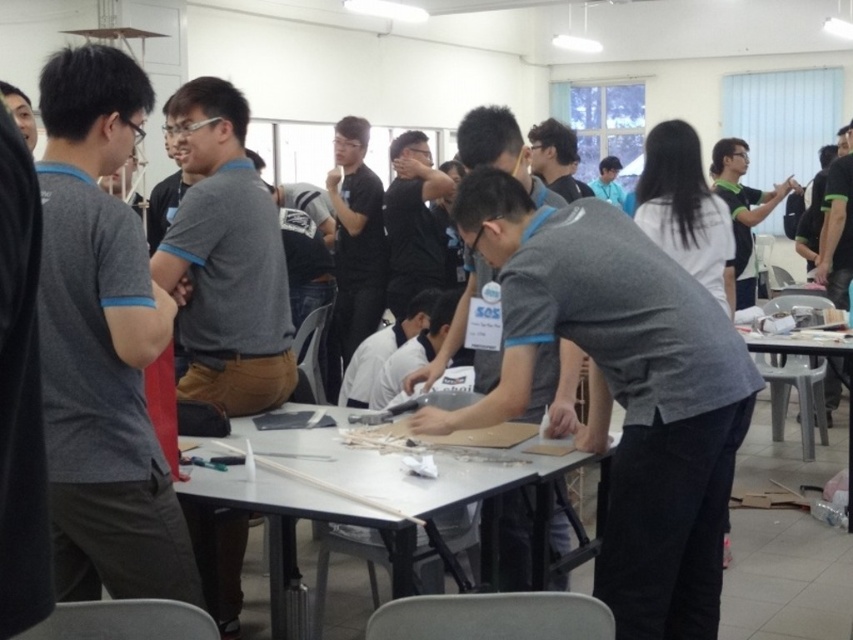
Question: Among these objects, which one is farthest from the camera?

Choices:
 (A) clear plastic table at right
 (B) white plastic table at center

Answer: (A)

Question: Does gray matte shirt at center appear on the right side of white plastic table at center?

Choices:
 (A) no
 (B) yes

Answer: (B)

Question: Among these objects, which one is farthest from the camera?

Choices:
 (A) white plastic table at center
 (B) clear plastic table at right
 (C) gray matte shirt at center

Answer: (B)

Question: Does gray matte shirt at center appear under white plastic table at center?

Choices:
 (A) yes
 (B) no

Answer: (B)

Question: Which point appears farthest from the camera in this image?

Choices:
 (A) (631, 445)
 (B) (210, 476)

Answer: (B)

Question: Is white plastic table at center to the right of clear plastic table at right from the viewer's perspective?

Choices:
 (A) no
 (B) yes

Answer: (A)